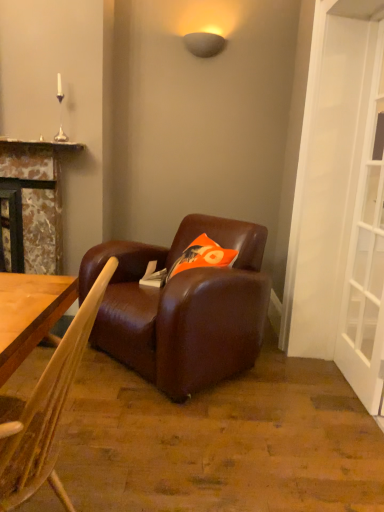
Question: From their relative heights in the image, would you say orange fabric pillow at center is taller or shorter than brown leather couch at center?

Choices:
 (A) short
 (B) tall

Answer: (A)

Question: Is point pyautogui.click(x=205, y=241) positioned closer to the camera than point pyautogui.click(x=188, y=298)?

Choices:
 (A) farther
 (B) closer

Answer: (A)

Question: Which object is positioned farthest from the brown leather couch at center?

Choices:
 (A) orange fabric pillow at center
 (B) brown leather chair at center
 (C) white glass screen door at right

Answer: (B)

Question: Based on their relative distances, which object is farther from the orange fabric pillow at center?

Choices:
 (A) brown leather chair at center
 (B) white glass screen door at right
 (C) brown leather couch at center

Answer: (A)